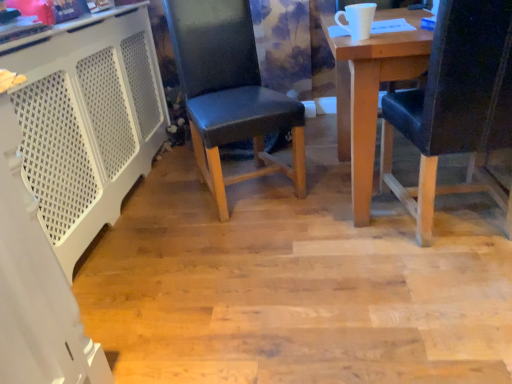
Question: Is white perforated plastic at left wider or thinner than black leather chair at right, the 1th chair in the right-to-left sequence?

Choices:
 (A) thin
 (B) wide

Answer: (A)

Question: Is white perforated plastic at left in front of or behind black leather chair at right, the 1th chair in the right-to-left sequence, in the image?

Choices:
 (A) front
 (B) behind

Answer: (B)

Question: Which object is positioned farthest from the black leather chair at right, which is counted as the 2th chair, starting from the left?

Choices:
 (A) black leather chair at center, placed as the 1th chair when sorted from left to right
 (B) white perforated plastic at left

Answer: (B)

Question: Estimate the real-world distances between objects in this image. Which object is closer to the black leather chair at center, placed as the 1th chair when sorted from left to right?

Choices:
 (A) white perforated plastic at left
 (B) black leather chair at right, the 1th chair in the right-to-left sequence

Answer: (A)